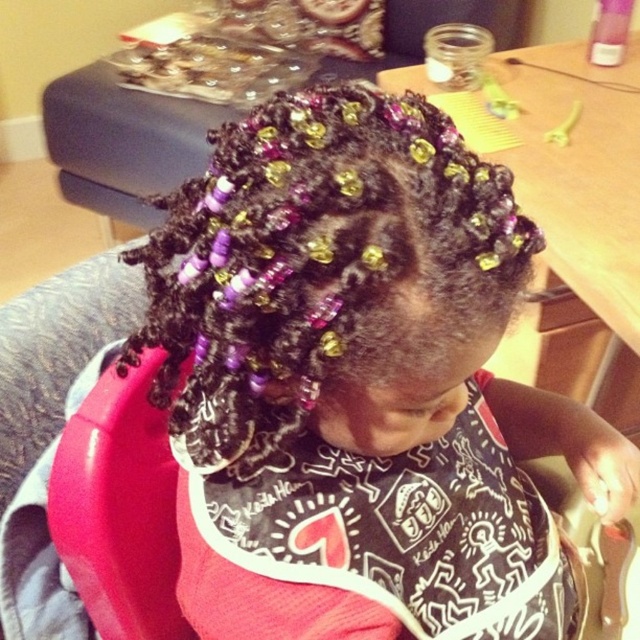
Does purple beaded hair at center have a greater width compared to black printed bib at center?

Incorrect, purple beaded hair at center's width does not surpass black printed bib at center's.

Does point (240, 154) lie in front of point (332, 509)?

Yes, point (240, 154) is closer to viewer.

What are the coordinates of `purple beaded hair at center` in the screenshot? It's located at (320, 260).